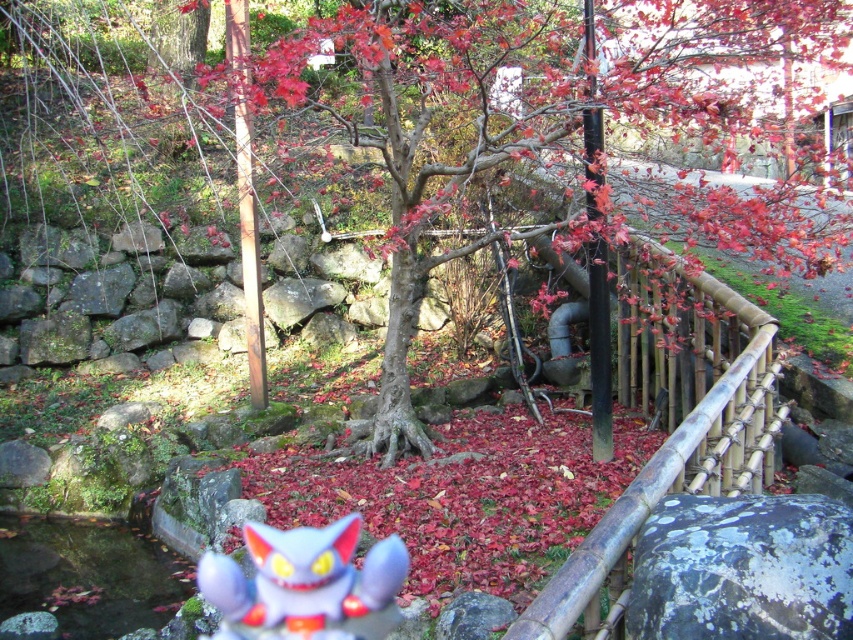
In the scene shown: Is bamboo fence at upper right positioned in front of clear water at creek center?

Yes, bamboo fence at upper right is in front of clear water at creek center.

Which is in front, point (695, 394) or point (155, 541)?

Point (695, 394) is in front.

The image size is (853, 640). What are the coordinates of `bamboo fence at upper right` in the screenshot? It's located at tap(671, 424).

Does point (398, 19) lie in front of point (677, 378)?

No, it is behind (677, 378).

Measure the distance between point (808, 192) and camera.

A distance of 3.59 meters exists between point (808, 192) and camera.

Is point (405, 384) farther from viewer compared to point (556, 625)?

Yes, it is behind point (556, 625).

Locate an element on the screen. smooth bark tree at center is located at coordinates (418, 124).

Does point (711, 624) come closer to viewer compared to point (335, 602)?

Yes, it is.

Does speckled gray rock at center come behind plush purple cat at center?

No.

Where is `speckled gray rock at center`? This screenshot has width=853, height=640. speckled gray rock at center is located at coordinates [741, 568].